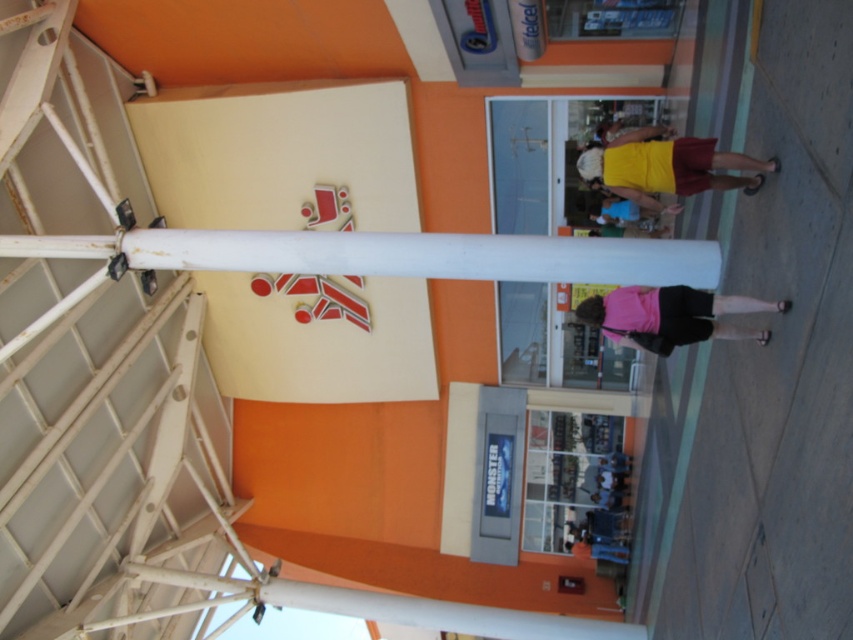
Looking at this image, you are a window cleaner with a 2.5 meter ladder. You need to clean the glass windows of the storefront while avoiding the white metal structure in the foreground. Can you reach the yellow matte shirt at upper center and the pink fabric at center with your current ladder height?

The yellow matte shirt at upper center occupies less space than pink fabric at center, but since both are within the storefront area and the ladder is 2.5 meters tall, you should be able to reach both areas as long as the white metal structure doesn

You are a window cleaner standing on the sidewalk outside the store. You need to clean both the yellow matte shirt at upper center and the pink fabric at center. Which object should you clean first if you want to start from the highest point?

The yellow matte shirt at upper center should be cleaned first since it is located above the pink fabric at center, making it the higher of the two.

You are a delivery person with a box that is 3 meters long. You need to move the box from the yellow matte shirt at upper center to the pink fabric at center. Is the space between them long enough to move the box without tilting it?

The distance between the yellow matte shirt at upper center and the pink fabric at center is 3.39 meters, which is longer than the 3 meters length of the box. Therefore, the space is sufficient to move the box without tilting it.